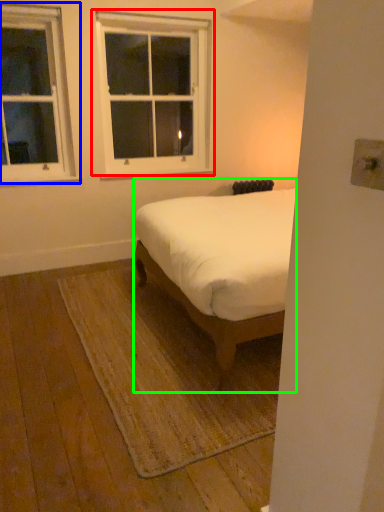
Question: Which object is positioned farthest from window (highlighted by a red box)? Select from window (highlighted by a blue box) and bed (highlighted by a green box).

Choices:
 (A) window
 (B) bed

Answer: (B)